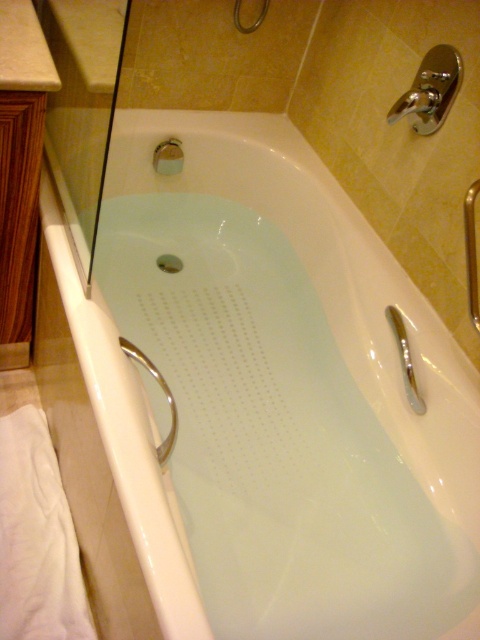
Question: Does white glossy sink at upper left have a larger size compared to matte silver showerhead at upper center?

Choices:
 (A) no
 (B) yes

Answer: (B)

Question: Considering the real-world distances, which object is farthest from the white glossy sink at upper left?

Choices:
 (A) matte silver showerhead at upper center
 (B) silver metallic faucet at right

Answer: (B)

Question: Which point is closer to the camera taking this photo?

Choices:
 (A) (115, 29)
 (B) (403, 362)

Answer: (A)

Question: Is white glossy sink at upper left wider than polished chrome shower head at upper right?

Choices:
 (A) no
 (B) yes

Answer: (B)

Question: Which point appears farthest from the camera in this image?

Choices:
 (A) (92, 61)
 (B) (403, 372)
 (C) (179, 156)
 (D) (441, 115)

Answer: (C)

Question: Can you confirm if white glossy sink at upper left is thinner than matte silver showerhead at upper center?

Choices:
 (A) yes
 (B) no

Answer: (B)